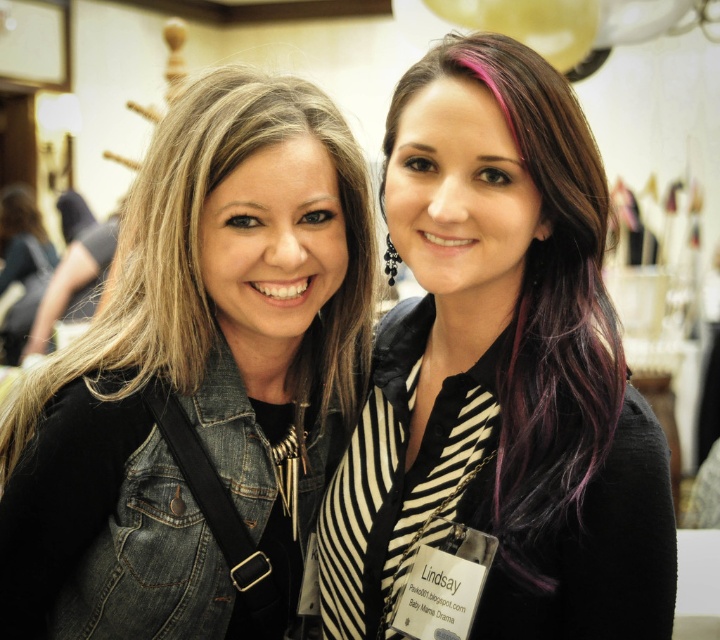
Between denim jacket at left and purplehair at right, which one is positioned lower?

denim jacket at left is lower down.

Who is shorter, denim jacket at left or purplehair at right?

With less height is purplehair at right.

The height and width of the screenshot is (640, 720). Find the location of `denim jacket at left`. denim jacket at left is located at coordinates (197, 376).